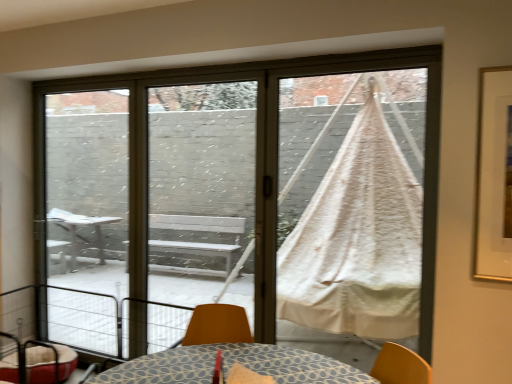
Measure the distance between transparent glass screen door at center, positioned as the 2th screen door in left-to-right order, and camera.

transparent glass screen door at center, positioned as the 2th screen door in left-to-right order, is 12.11 feet from camera.

From the picture: Measure the distance between point (63, 241) and camera.

The depth of point (63, 241) is 3.60 meters.

Identify the location of transparent glass screen door at left, which ranks as the 2th screen door in right-to-left order. (87, 218).

This screenshot has width=512, height=384. Identify the location of metallic wire balcony at lower left. (111, 322).

I want to click on transparent glass screen door at center, positioned as the 1th screen door in right-to-left order, so click(x=201, y=193).

From the image's perspective, who appears lower, white cotton hammock at right or transparent glass screen door at left, which ranks as the 2th screen door in right-to-left order?

transparent glass screen door at left, which ranks as the 2th screen door in right-to-left order, from the image's perspective.

From a real-world perspective, is white cotton hammock at right on transparent glass screen door at left, which ranks as the 2th screen door in right-to-left order?

Yes, from a real-world perspective, white cotton hammock at right is over transparent glass screen door at left, which ranks as the 2th screen door in right-to-left order

Is white cotton hammock at right aimed at transparent glass screen door at left, acting as the first screen door starting from the left?

No, white cotton hammock at right does not turn towards transparent glass screen door at left, acting as the first screen door starting from the left.

How distant is transparent glass screen door at center, positioned as the 1th screen door in right-to-left order, from white cotton hammock at right?

A distance of 4.72 feet exists between transparent glass screen door at center, positioned as the 1th screen door in right-to-left order, and white cotton hammock at right.

Considering the positions of objects transparent glass screen door at center, positioned as the 2th screen door in left-to-right order, and white cotton hammock at right in the image provided, who is more to the left, transparent glass screen door at center, positioned as the 2th screen door in left-to-right order, or white cotton hammock at right?

transparent glass screen door at center, positioned as the 2th screen door in left-to-right order.

Considering the sizes of objects transparent glass screen door at center, positioned as the 1th screen door in right-to-left order, and white cotton hammock at right in the image provided, who is taller, transparent glass screen door at center, positioned as the 1th screen door in right-to-left order, or white cotton hammock at right?

With more height is transparent glass screen door at center, positioned as the 1th screen door in right-to-left order.

Does transparent glass screen door at center, positioned as the 2th screen door in left-to-right order, turn towards white cotton hammock at right?

No, transparent glass screen door at center, positioned as the 2th screen door in left-to-right order, does not turn towards white cotton hammock at right.

Which object is positioned more to the right, transparent glass screen door at center, positioned as the 1th screen door in right-to-left order, or velvet red pet bed at lower left?

From the viewer's perspective, transparent glass screen door at center, positioned as the 1th screen door in right-to-left order, appears more on the right side.

Is the depth of transparent glass screen door at center, positioned as the 1th screen door in right-to-left order, greater than that of velvet red pet bed at lower left?

No, transparent glass screen door at center, positioned as the 1th screen door in right-to-left order, is closer to the camera.

In order to click on furniture below the transparent glass screen door at center, positioned as the 2th screen door in left-to-right order (from the image's perspective) in this screenshot , I will do `click(37, 362)`.

Based on their sizes in the image, would you say transparent glass screen door at center, positioned as the 1th screen door in right-to-left order, is bigger or smaller than velvet red pet bed at lower left?

In the image, transparent glass screen door at center, positioned as the 1th screen door in right-to-left order, appears to be larger than velvet red pet bed at lower left.

In the image, there is a metallic wire balcony at lower left. At what (x,y) coordinates should I click in order to perform the action: click on blanket above it (from the image's perspective). Please return your answer as a coordinate pair (x, y). Looking at the image, I should click on (352, 203).

Are metallic wire balcony at lower left and white cotton hammock at right far apart?

That's right, there is a large distance between metallic wire balcony at lower left and white cotton hammock at right.

Considering the sizes of objects metallic wire balcony at lower left and white cotton hammock at right in the image provided, who is bigger, metallic wire balcony at lower left or white cotton hammock at right?

metallic wire balcony at lower left.

From a real-world perspective, who is located lower, metallic wire balcony at lower left or white cotton hammock at right?

metallic wire balcony at lower left is physically lower.

The height and width of the screenshot is (384, 512). Find the location of `window located above the metallic wire balcony at lower left (from the image's perspective)`. window located above the metallic wire balcony at lower left (from the image's perspective) is located at coordinates (242, 199).

From the image's perspective, between white fabric hammock at center and metallic wire balcony at lower left, which one is located above?

white fabric hammock at center.

Considering the sizes of objects white fabric hammock at center and metallic wire balcony at lower left in the image provided, who is taller, white fabric hammock at center or metallic wire balcony at lower left?

white fabric hammock at center is taller.

Can you tell me how much transparent glass screen door at left, acting as the first screen door starting from the left, and white cotton hammock at right differ in facing direction?

The facing directions of transparent glass screen door at left, acting as the first screen door starting from the left, and white cotton hammock at right are 1.69 degrees apart.

Which object is positioned more to the right, transparent glass screen door at left, acting as the first screen door starting from the left, or white cotton hammock at right?

Positioned to the right is white cotton hammock at right.

Image resolution: width=512 pixels, height=384 pixels. Find the location of `blanket located on the right of transparent glass screen door at left, acting as the first screen door starting from the left`. blanket located on the right of transparent glass screen door at left, acting as the first screen door starting from the left is located at coordinates (352, 203).

From a real-world perspective, is transparent glass screen door at left, acting as the first screen door starting from the left, positioned above or below white cotton hammock at right?

In terms of real-world spatial position, transparent glass screen door at left, acting as the first screen door starting from the left, is below white cotton hammock at right.

From the image's perspective, is transparent glass screen door at left, acting as the first screen door starting from the left, on velvet red pet bed at lower left?

Yes, from the image's perspective, transparent glass screen door at left, acting as the first screen door starting from the left, is over velvet red pet bed at lower left.

Considering the relative sizes of transparent glass screen door at left, which ranks as the 2th screen door in right-to-left order, and velvet red pet bed at lower left in the image provided, is transparent glass screen door at left, which ranks as the 2th screen door in right-to-left order, thinner than velvet red pet bed at lower left?

Correct, the width of transparent glass screen door at left, which ranks as the 2th screen door in right-to-left order, is less than that of velvet red pet bed at lower left.

Does transparent glass screen door at left, which ranks as the 2th screen door in right-to-left order, touch velvet red pet bed at lower left?

transparent glass screen door at left, which ranks as the 2th screen door in right-to-left order, and velvet red pet bed at lower left are not in contact.

Is transparent glass screen door at left, acting as the first screen door starting from the left, positioned with its back to velvet red pet bed at lower left?

transparent glass screen door at left, acting as the first screen door starting from the left, does not have its back to velvet red pet bed at lower left.

Identify the location of screen door that is the 2nd one when counting downward from the white cotton hammock at right (from the image's perspective). The height and width of the screenshot is (384, 512). (87, 218).

Starting from the white cotton hammock at right, which screen door is the 1st one behind? Please provide its 2D coordinates.

[(201, 193)]

Which object lies further to the anchor point white cotton hammock at right, transparent glass screen door at left, which ranks as the 2th screen door in right-to-left order, or velvet red pet bed at lower left?

Based on the image, velvet red pet bed at lower left appears to be further to white cotton hammock at right.

Considering their positions, is white cotton hammock at right positioned closer to transparent glass screen door at center, positioned as the 2th screen door in left-to-right order, than velvet red pet bed at lower left?

white cotton hammock at right is closer to transparent glass screen door at center, positioned as the 2th screen door in left-to-right order.

Estimate the real-world distances between objects in this image. Which object is closer to white cotton hammock at right, white fabric hammock at center or transparent glass screen door at center, positioned as the 1th screen door in right-to-left order?

white fabric hammock at center is closer to white cotton hammock at right.

Considering their positions, is metallic wire balcony at lower left positioned further to white cotton hammock at right than transparent glass screen door at left, acting as the first screen door starting from the left?

metallic wire balcony at lower left is further to white cotton hammock at right.

Estimate the real-world distances between objects in this image. Which object is further from transparent glass screen door at left, which ranks as the 2th screen door in right-to-left order, transparent glass screen door at center, positioned as the 1th screen door in right-to-left order, or velvet red pet bed at lower left?

velvet red pet bed at lower left.

Looking at the image, which one is located closer to transparent glass screen door at center, positioned as the 2th screen door in left-to-right order, transparent glass screen door at left, which ranks as the 2th screen door in right-to-left order, or white fabric hammock at center?

Based on the image, transparent glass screen door at left, which ranks as the 2th screen door in right-to-left order, appears to be nearer to transparent glass screen door at center, positioned as the 2th screen door in left-to-right order.

Based on their spatial positions, is white fabric hammock at center or transparent glass screen door at center, positioned as the 2th screen door in left-to-right order, closer to velvet red pet bed at lower left?

Among the two, transparent glass screen door at center, positioned as the 2th screen door in left-to-right order, is located nearer to velvet red pet bed at lower left.

Based on the photo, estimate the real-world distances between objects in this image. Which object is closer to metallic wire balcony at lower left, white cotton hammock at right or white fabric hammock at center?

white fabric hammock at center lies closer to metallic wire balcony at lower left than the other object.

The width and height of the screenshot is (512, 384). In order to click on screen door between metallic wire balcony at lower left and white fabric hammock at center from left to right in this screenshot , I will do `click(201, 193)`.

Where is `balcony between velvet red pet bed at lower left and white fabric hammock at center`? This screenshot has height=384, width=512. balcony between velvet red pet bed at lower left and white fabric hammock at center is located at coordinates (111, 322).

Locate an element on the screen. balcony situated between velvet red pet bed at lower left and white cotton hammock at right from left to right is located at coordinates (111, 322).

Find the location of a particular element. screen door between transparent glass screen door at center, positioned as the 1th screen door in right-to-left order, and velvet red pet bed at lower left vertically is located at coordinates (87, 218).